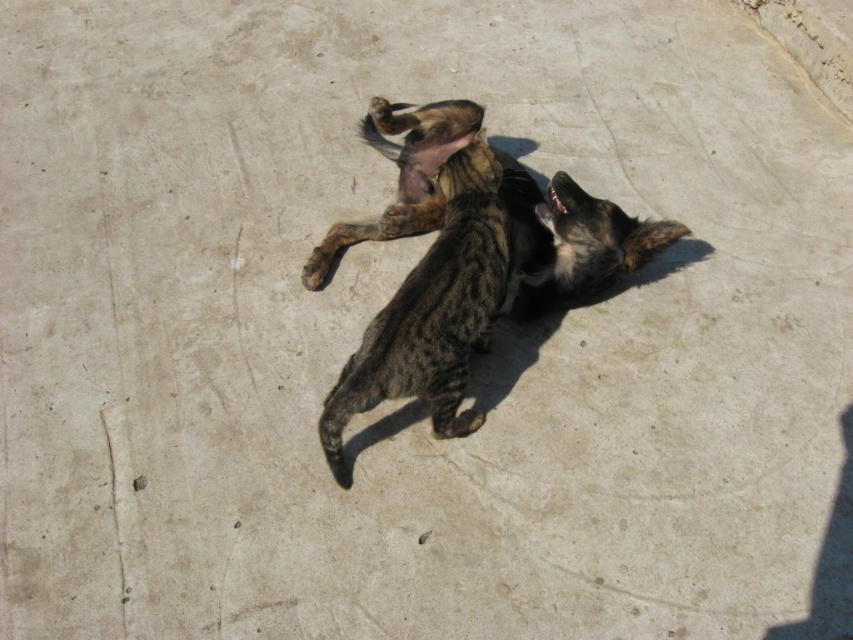
You are a photographer trying to capture a photo of the brown fur dog at center and the dark brown fur paw at upper center. If you want to ensure both subjects are fully visible in the frame, which one should you focus on to avoid cropping out either?

You should focus on the brown fur dog at center because its width is larger than the dark brown fur paw at upper center, so centering the frame on the dog would ensure both are visible without cropping.

You are a photographer standing at a certain position. You notice two points in the image, namely point (421, 115) and point (320, 285). Which point is closer to you?

Point (421, 115) is further to the viewer than point (320, 285), so the closer point to you is point (320, 285).

Looking at the scene where a cat and a dog are interacting on a concrete surface, can you determine which object is positioned to the right of the other between the brown fur dog at center and the dark brown fur paw at upper center?

The brown fur dog at center is positioned to the right of the dark brown fur paw at upper center.